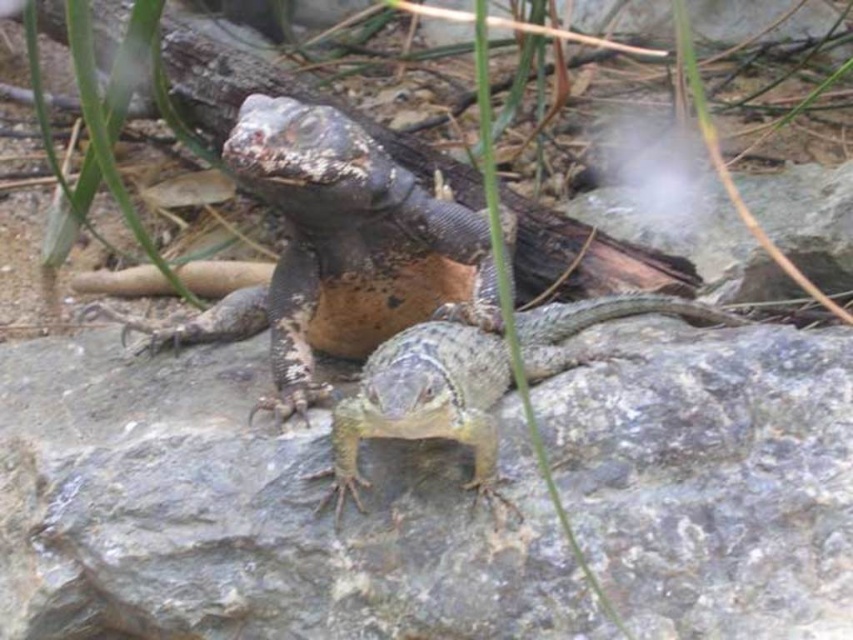
Question: Can you confirm if gray rock at center is positioned below leathery brown lizard at center?

Choices:
 (A) yes
 (B) no

Answer: (A)

Question: Is leathery brown lizard at center to the right of smooth gray lizard at center from the viewer's perspective?

Choices:
 (A) yes
 (B) no

Answer: (B)

Question: Considering the real-world distances, which object is closest to the leathery brown lizard at center?

Choices:
 (A) smooth gray lizard at center
 (B) gray rock at center

Answer: (A)

Question: Which of the following is the farthest from the observer?

Choices:
 (A) leathery brown lizard at center
 (B) gray rock at center

Answer: (A)

Question: From the image, what is the correct spatial relationship of gray rock at center in relation to leathery brown lizard at center?

Choices:
 (A) left
 (B) right

Answer: (B)

Question: Which point is closer to the camera?

Choices:
 (A) gray rock at center
 (B) leathery brown lizard at center
 (C) smooth gray lizard at center

Answer: (C)